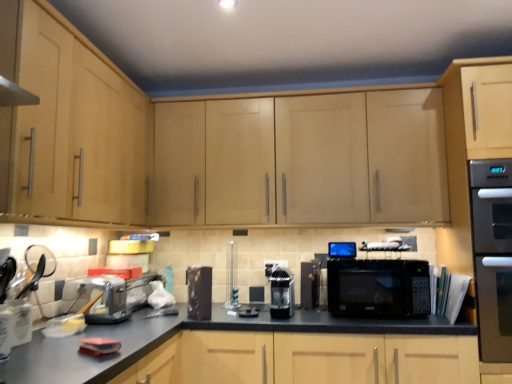
Question: Can you confirm if sleek black coffee machine at center, which appears as the third appliance when viewed from the left, is positioned to the left of stainless steel oven at right?

Choices:
 (A) no
 (B) yes

Answer: (B)

Question: Can you confirm if sleek black coffee machine at center, marked as the 3th appliance in a right-to-left arrangement, is thinner than stainless steel oven at right?

Choices:
 (A) yes
 (B) no

Answer: (A)

Question: Is sleek black coffee machine at center, marked as the 3th appliance in a right-to-left arrangement, outside stainless steel oven at right?

Choices:
 (A) yes
 (B) no

Answer: (A)

Question: Is sleek black coffee machine at center, which appears as the third appliance when viewed from the left, shorter than stainless steel oven at right?

Choices:
 (A) no
 (B) yes

Answer: (B)

Question: Does sleek black coffee machine at center, which appears as the third appliance when viewed from the left, have a larger size compared to stainless steel oven at right?

Choices:
 (A) yes
 (B) no

Answer: (B)

Question: Is black matte microwave at center taller or shorter than light wood cabinet at left, marked as the second cabinetry in a right-to-left arrangement?

Choices:
 (A) tall
 (B) short

Answer: (B)

Question: Is black matte microwave at center to the left or to the right of light wood cabinet at left, the 1th cabinetry viewed from the left, in the image?

Choices:
 (A) right
 (B) left

Answer: (A)

Question: Relative to light wood cabinet at left, the 1th cabinetry viewed from the left, is black matte microwave at center in front or behind?

Choices:
 (A) front
 (B) behind

Answer: (B)

Question: In terms of width, does black matte microwave at center look wider or thinner when compared to light wood cabinet at left, marked as the second cabinetry in a right-to-left arrangement?

Choices:
 (A) thin
 (B) wide

Answer: (B)

Question: Considering the positions of black matte countertop at center and black glossy coffee maker at center, positioned as the fourth appliance in right-to-left order, in the image, is black matte countertop at center wider or thinner than black glossy coffee maker at center, positioned as the fourth appliance in right-to-left order,?

Choices:
 (A) thin
 (B) wide

Answer: (B)

Question: From their relative heights in the image, would you say black matte countertop at center is taller or shorter than black glossy coffee maker at center, which is the 2th appliance from left to right?

Choices:
 (A) tall
 (B) short

Answer: (A)

Question: Considering their positions, is black matte countertop at center located in front of or behind black glossy coffee maker at center, which is the 2th appliance from left to right?

Choices:
 (A) behind
 (B) front

Answer: (B)

Question: Is point 98,374 closer or farther from the camera than point 208,301?

Choices:
 (A) farther
 (B) closer

Answer: (B)

Question: Which is correct: stainless steel oven at right is inside light wood cabinet at upper center, the second cabinetry viewed from the left, or outside of it?

Choices:
 (A) outside
 (B) inside

Answer: (A)

Question: In terms of width, does stainless steel oven at right look wider or thinner when compared to light wood cabinet at upper center, the first cabinetry when ordered from right to left?

Choices:
 (A) wide
 (B) thin

Answer: (A)